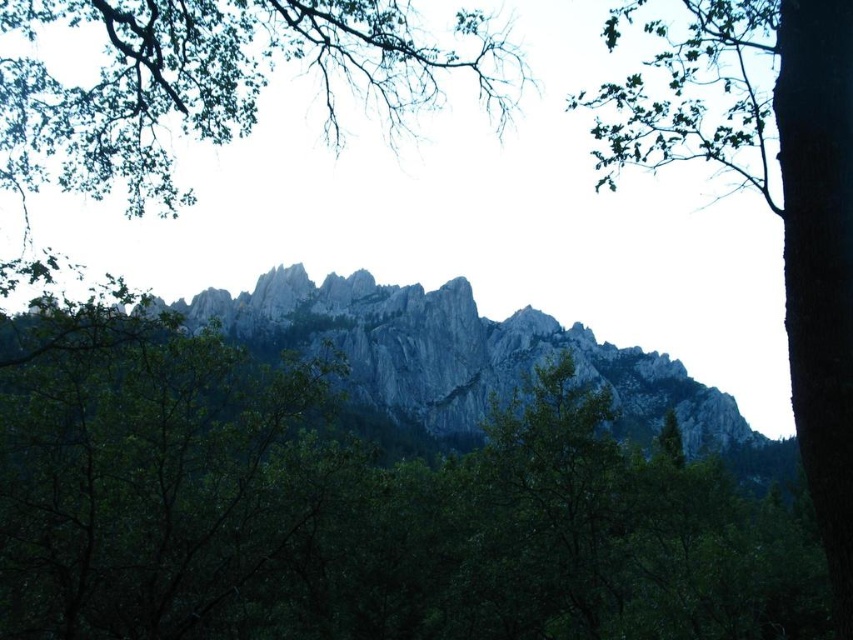
You are a hiker standing at the base of the mountain and want to reach the closest tree. Which tree should you head towards, the green leafy tree at upper center or the green leafy tree at upper right?

The green leafy tree at upper center is 68.38 meters away from the green leafy tree at upper right. Since you are at the base of the mountain, you need to determine which tree is closer. However, the distance between the two trees is provided, but not their individual distances from the hiker. Without knowing their exact positions relative to the hiker, it is impossible to determine which is closer. Please provide more information about their individual distances from your current position.

You are standing in the middle of the forest looking towards the mountain range. There is a green leafy tree at upper center marked by point (x=216, y=83). Can you see the mountain peaks behind this tree?

The green leafy tree at upper center is represented by point (x=216, y=83), so yes, you can see the mountain peaks behind it because the tree is in the foreground and the mountains are in the background.